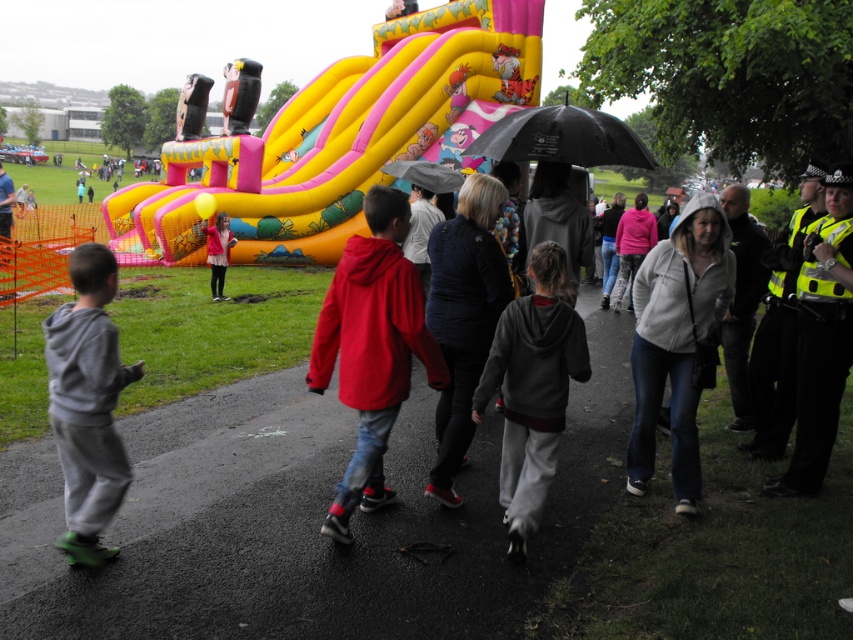
Does gray fleece jacket at lower left appear on the right side of dark blue sweater at center?

Incorrect, gray fleece jacket at lower left is not on the right side of dark blue sweater at center.

The width and height of the screenshot is (853, 640). Find the location of `gray fleece jacket at lower left`. gray fleece jacket at lower left is located at coordinates (86, 403).

The width and height of the screenshot is (853, 640). In order to click on gray fleece jacket at lower left in this screenshot , I will do `click(86, 403)`.

Does red matte jacket at center have a smaller size compared to black matte umbrella at upper center?

Incorrect, red matte jacket at center is not smaller in size than black matte umbrella at upper center.

Which is behind, point (328, 332) or point (508, 147)?

Point (508, 147)

Locate an element on the screen. Image resolution: width=853 pixels, height=640 pixels. red matte jacket at center is located at coordinates (372, 348).

Between black matte umbrella at upper center and matte pink hoodie at center, which one appears on the left side from the viewer's perspective?

Positioned to the left is matte pink hoodie at center.

Locate an element on the screen. This screenshot has height=640, width=853. black matte umbrella at upper center is located at coordinates (561, 138).